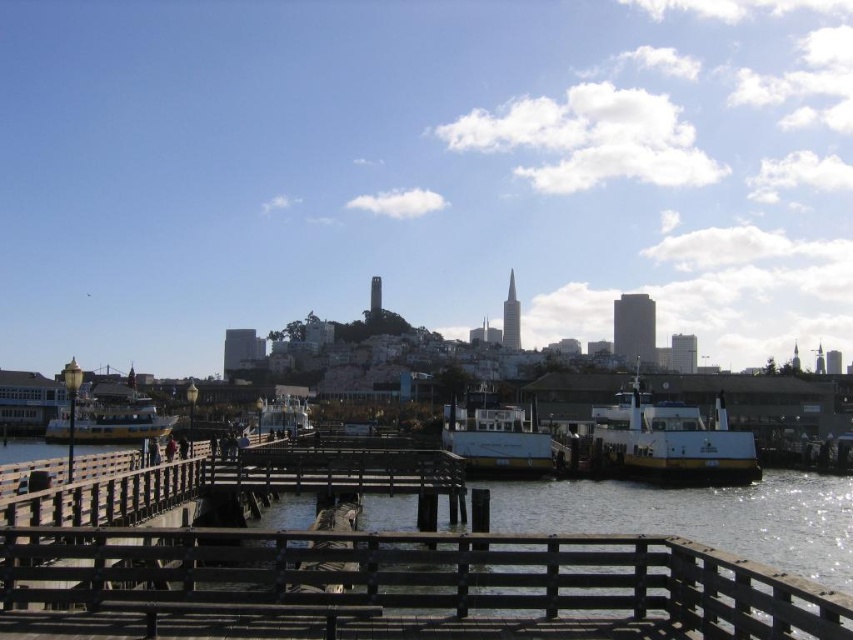
Can you confirm if yellow matte boat at right is smaller than white matte boat at center?

No.

Can you confirm if yellow matte boat at right is bigger than white matte boat at center?

Yes.

The image size is (853, 640). I want to click on yellow matte boat at right, so click(671, 442).

Image resolution: width=853 pixels, height=640 pixels. I want to click on yellow matte boat at right, so click(671, 442).

Is yellow matte boat at right to the left of yellow polished wood ferry at left from the viewer's perspective?

No, yellow matte boat at right is not to the left of yellow polished wood ferry at left.

Can you confirm if yellow matte boat at right is bigger than yellow polished wood ferry at left?

No, yellow matte boat at right is not bigger than yellow polished wood ferry at left.

The height and width of the screenshot is (640, 853). Identify the location of yellow matte boat at right. (671, 442).

Is white matte boat at center further to camera compared to yellow polished wood ferry at left?

No, white matte boat at center is closer to the viewer.

Is white matte boat at center below yellow polished wood ferry at left?

Actually, white matte boat at center is above yellow polished wood ferry at left.

Is point (541, 467) closer to viewer compared to point (88, 429)?

Yes, point (541, 467) is closer to viewer.

Locate an element on the screen. The image size is (853, 640). white matte boat at center is located at coordinates (494, 436).